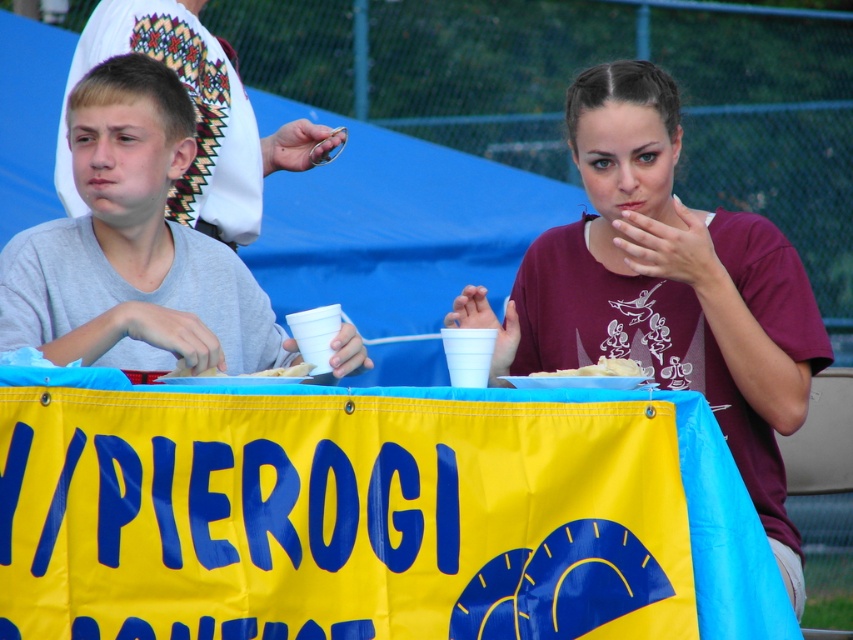
You are a food critic attending a pierogi festival and see the white matte food at center on the table. Can you estimate its position relative to the table?

The white matte food at center is located at the coordinates point [599,369] on the table.